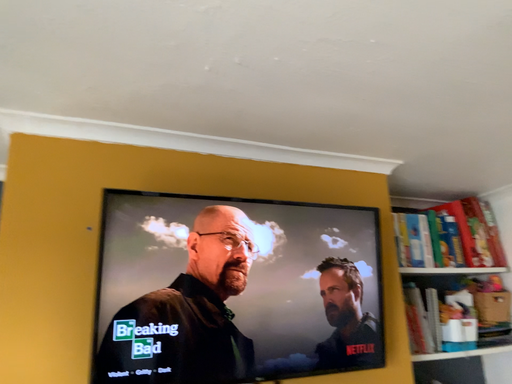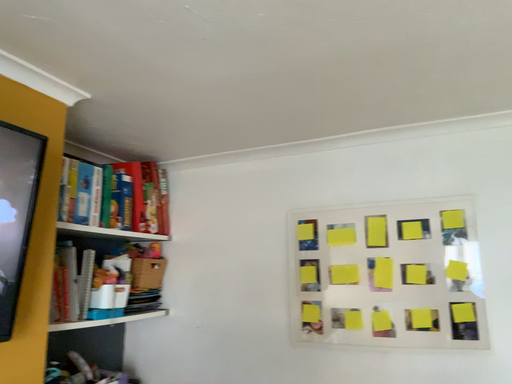
Question: How did the camera likely rotate when shooting the video?

Choices:
 (A) rotated left
 (B) rotated right

Answer: (B)